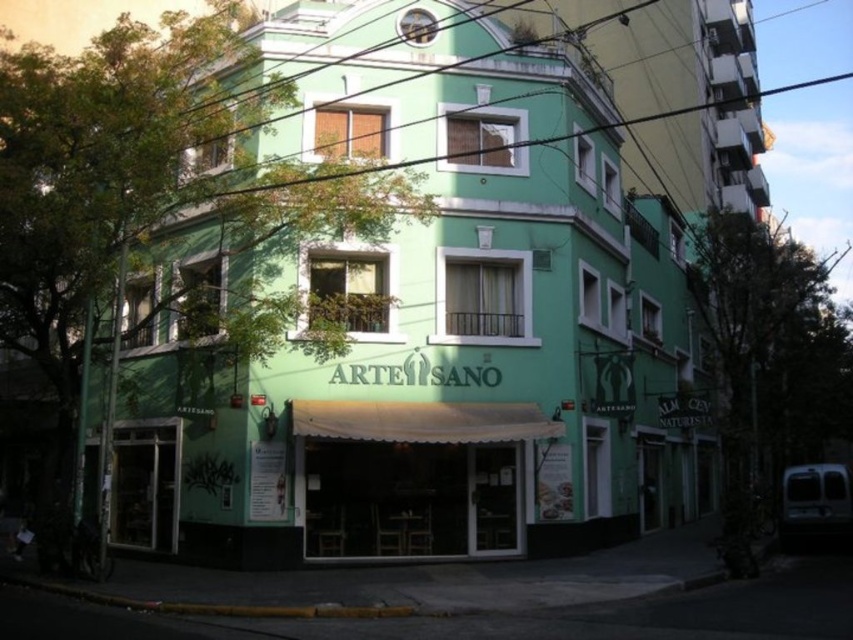
Question: Is green matte building at center above white fabric awning at center?

Choices:
 (A) yes
 (B) no

Answer: (A)

Question: Does green matte building at center have a lesser width compared to white fabric awning at center?

Choices:
 (A) yes
 (B) no

Answer: (B)

Question: Among these objects, which one is nearest to the camera?

Choices:
 (A) white fabric awning at center
 (B) green matte building at center

Answer: (A)

Question: Can you confirm if green matte building at center is wider than white fabric awning at center?

Choices:
 (A) yes
 (B) no

Answer: (A)

Question: Which point appears farthest from the camera in this image?

Choices:
 (A) (428, 497)
 (B) (410, 68)

Answer: (B)